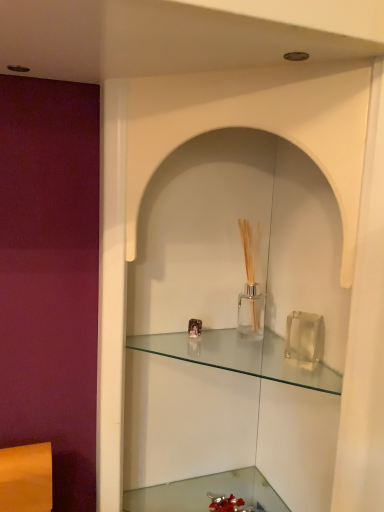
The image size is (384, 512). Describe the element at coordinates (240, 356) in the screenshot. I see `clear glass shelf at center` at that location.

The image size is (384, 512). Find the location of `clear glass shelf at center`. clear glass shelf at center is located at coordinates (240, 356).

Measure the distance between clear glass vase at lower center and camera.

clear glass vase at lower center and camera are 34.45 inches apart.

Identify the location of clear glass vase at lower center. (205, 493).

Describe the element at coordinates (205, 493) in the screenshot. The height and width of the screenshot is (512, 384). I see `clear glass vase at lower center` at that location.

In order to click on clear glass shelf at center in this screenshot , I will do `click(240, 356)`.

Which is more to the left, clear glass vase at lower center or clear glass shelf at center?

clear glass vase at lower center is more to the left.

In the image, is clear glass vase at lower center positioned in front of or behind clear glass shelf at center?

Clearly, clear glass vase at lower center is behind clear glass shelf at center.

Which is more distant, (135,498) or (231,358)?

Point (231,358)

From the image's perspective, relative to clear glass shelf at center, is clear glass vase at lower center above or below?

From the image's perspective, clear glass vase at lower center appears below clear glass shelf at center.

From a real-world perspective, is clear glass vase at lower center located higher than clear glass shelf at center?

Actually, clear glass vase at lower center is physically below clear glass shelf at center in the real world.

Considering the sizes of objects clear glass vase at lower center and clear glass shelf at center in the image provided, who is thinner, clear glass vase at lower center or clear glass shelf at center?

clear glass shelf at center.

Does clear glass vase at lower center have a lesser height compared to clear glass shelf at center?

In fact, clear glass vase at lower center may be taller than clear glass shelf at center.

Can you confirm if clear glass vase at lower center is bigger than clear glass shelf at center?

Indeed, clear glass vase at lower center has a larger size compared to clear glass shelf at center.

Would you say clear glass vase at lower center is outside clear glass shelf at center?

Yes, clear glass vase at lower center is located beyond the bounds of clear glass shelf at center.

Is the surface of clear glass vase at lower center in direct contact with clear glass shelf at center?

They are not placed beside each other.

Is clear glass vase at lower center facing towards clear glass shelf at center?

No, clear glass vase at lower center does not turn towards clear glass shelf at center.

How different are the orientations of clear glass vase at lower center and clear glass shelf at center in degrees?

The facing directions of clear glass vase at lower center and clear glass shelf at center are 0.513 degrees apart.

From the picture: How much distance is there between clear glass vase at lower center and clear glass shelf at center?

The distance of clear glass vase at lower center from clear glass shelf at center is 28.30 centimeters.

Where is `cabinetry below the clear glass shelf at center (from a real-world perspective)`? The width and height of the screenshot is (384, 512). cabinetry below the clear glass shelf at center (from a real-world perspective) is located at coordinates (205, 493).

Is clear glass shelf at center at the right side of clear glass vase at lower center?

Indeed, clear glass shelf at center is positioned on the right side of clear glass vase at lower center.

Which is behind, clear glass shelf at center or clear glass vase at lower center?

clear glass vase at lower center is more distant.

Considering the positions of point (242, 349) and point (169, 503), is point (242, 349) closer or farther from the camera than point (169, 503)?

Clearly, point (242, 349) is more distant from the camera than point (169, 503).

From the image's perspective, relative to clear glass vase at lower center, is clear glass shelf at center above or below?

Clearly, from the image's perspective, clear glass shelf at center is above clear glass vase at lower center.

From a real-world perspective, which is physically below, clear glass shelf at center or clear glass vase at lower center?

clear glass vase at lower center is physically lower.

Considering the sizes of objects clear glass shelf at center and clear glass vase at lower center in the image provided, who is wider, clear glass shelf at center or clear glass vase at lower center?

clear glass vase at lower center.

Does clear glass shelf at center have a greater height compared to clear glass vase at lower center?

No, clear glass shelf at center is not taller than clear glass vase at lower center.

Based on the photo, considering the sizes of objects clear glass shelf at center and clear glass vase at lower center in the image provided, who is bigger, clear glass shelf at center or clear glass vase at lower center?

Bigger between the two is clear glass vase at lower center.

Would you say clear glass shelf at center is outside clear glass vase at lower center?

Yes, clear glass shelf at center is not within clear glass vase at lower center.

Is clear glass shelf at center far away from clear glass vase at lower center?

clear glass shelf at center is actually quite close to clear glass vase at lower center.

Is clear glass shelf at center oriented towards clear glass vase at lower center?

No, clear glass shelf at center is not turned towards clear glass vase at lower center.

What's the angular difference between clear glass shelf at center and clear glass vase at lower center's facing directions?

0.513 degrees separate the facing orientations of clear glass shelf at center and clear glass vase at lower center.

At what (x,y) coordinates should I click in order to perform the action: click on cabinetry below the clear glass shelf at center (from the image's perspective). Please return your answer as a coordinate pair (x, y). The height and width of the screenshot is (512, 384). Looking at the image, I should click on (205, 493).

The height and width of the screenshot is (512, 384). I want to click on shelf lying on the right of clear glass vase at lower center, so click(240, 356).

Locate an element on the screen. This screenshot has height=512, width=384. cabinetry below the clear glass shelf at center (from the image's perspective) is located at coordinates (205, 493).